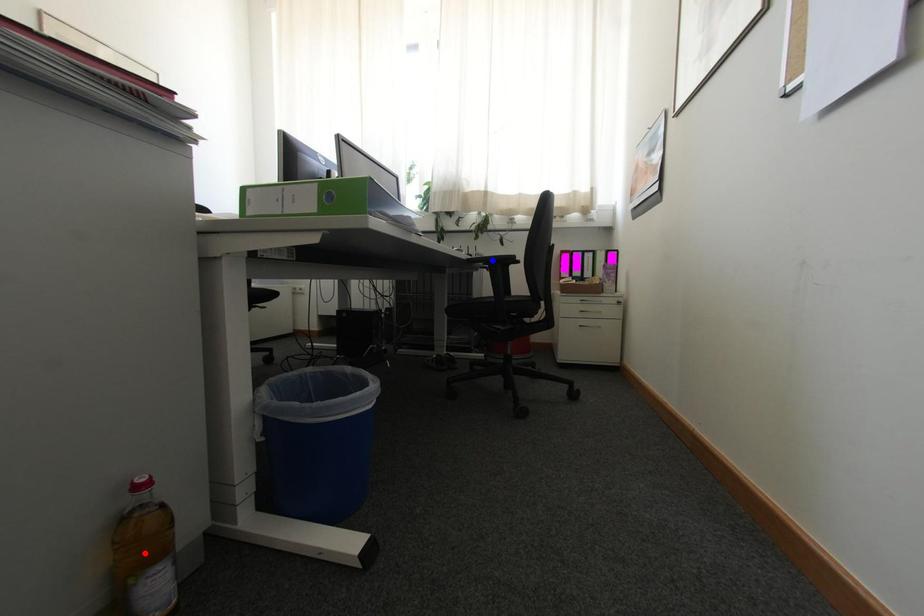
Question: Which of the two points in the image is closer to the camera?

Choices:
 (A) Blue point is closer.
 (B) Red point is closer.

Answer: (B)